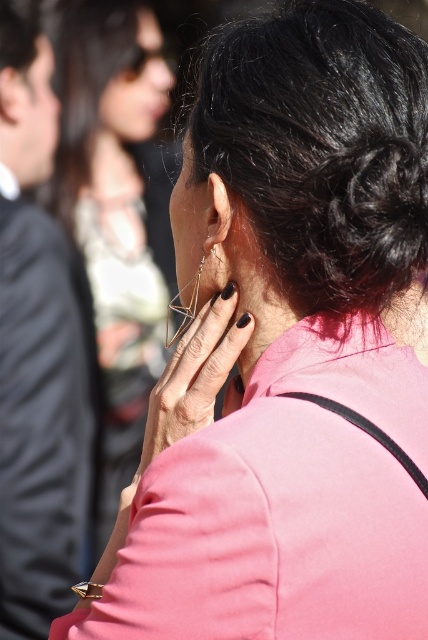
Does point (18, 113) come farther from viewer compared to point (222, 211)?

That is True.

Consider the image. Who is shorter, brushed metal ring at upper left or matte silver earring at center?

Standing shorter between the two is matte silver earring at center.

Where is `brushed metal ring at upper left`? brushed metal ring at upper left is located at coordinates (38, 352).

You are a GUI agent. You are given a task and a screenshot of the screen. Output one action in this format:
    pyautogui.click(x=<x>, y=<y>)
    Task: Click on the brushed metal ring at upper left
    
    Given the screenshot: What is the action you would take?
    pyautogui.click(x=38, y=352)

Which is below, gold metallic ring at center or matte silver earring at center?

gold metallic ring at center is lower down.

Does gold metallic ring at center have a lesser width compared to matte silver earring at center?

In fact, gold metallic ring at center might be wider than matte silver earring at center.

Who is more distant from viewer, (172, 369) or (205, 218)?

Point (172, 369)

Identify the location of gold metallic ring at center. click(x=195, y=374).

Does pink matte jacket at center have a larger size compared to gold metallic ring at center?

Yes, pink matte jacket at center is bigger than gold metallic ring at center.

Which is behind, point (142, 93) or point (223, 365)?

Point (142, 93)

Between point (56, 74) and point (184, 412), which one is positioned behind?

The point (56, 74) is more distant.

Find the location of a particular element. The width and height of the screenshot is (428, 640). pink matte jacket at center is located at coordinates click(x=112, y=208).